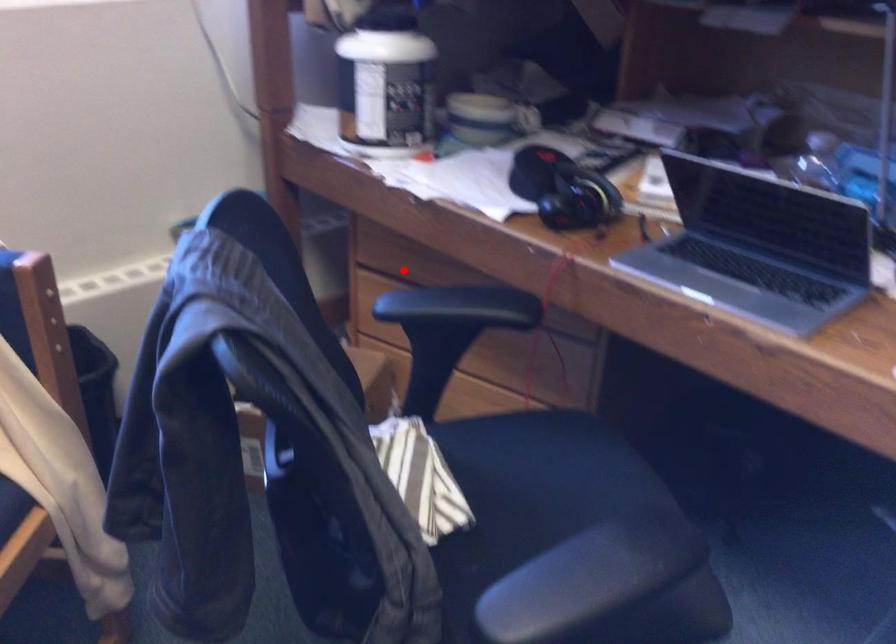
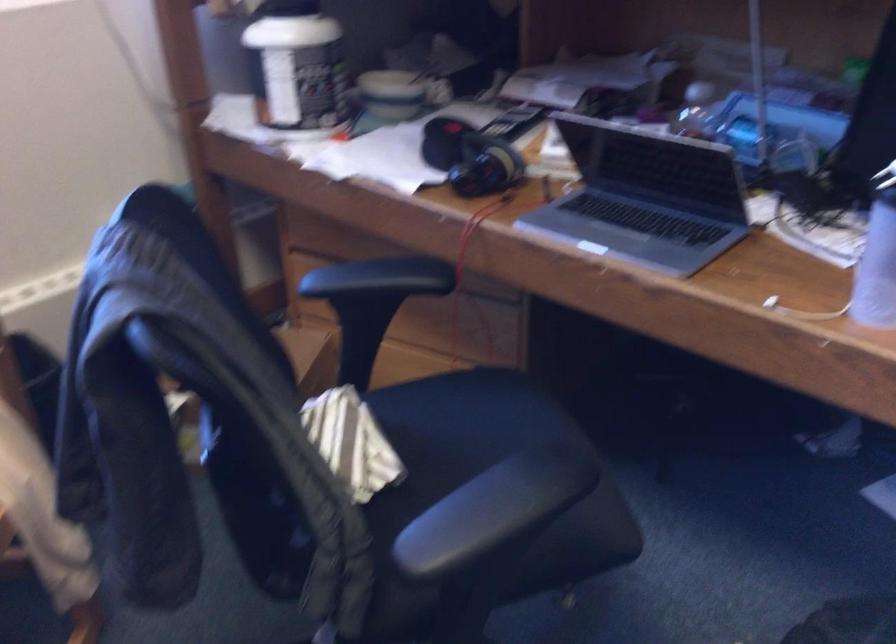
Where in the second image is the point corresponding to the highlighted location from the first image?

(333, 249)